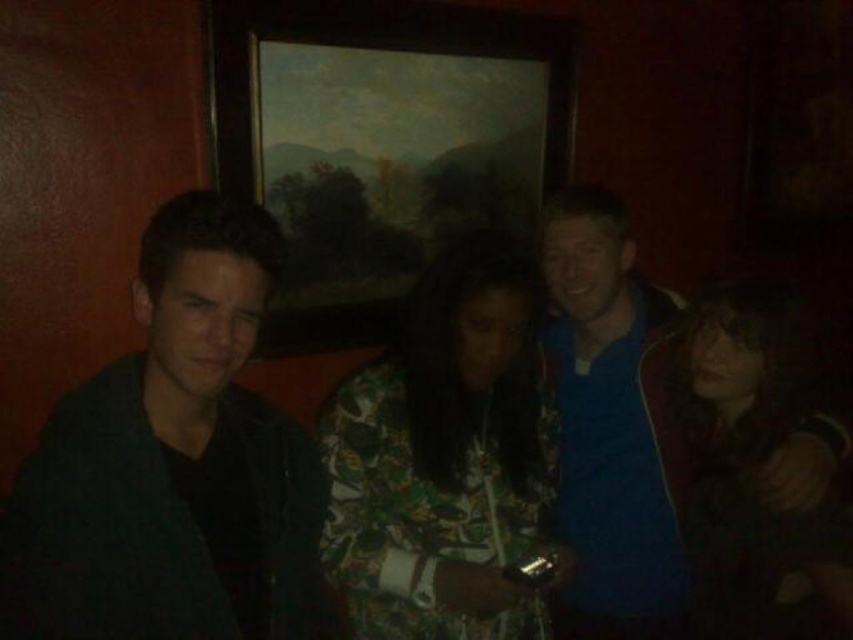
You are standing in the room and want to hang a new picture on the wall. The wooden framed painting at upper center is currently in the way. Can you hang your new picture above the dark green leather jacket at left without moving the existing painting?

The dark green leather jacket at left is positioned under the wooden framed painting at upper center, meaning there is no space above the jacket to hang the new picture without moving the existing painting.